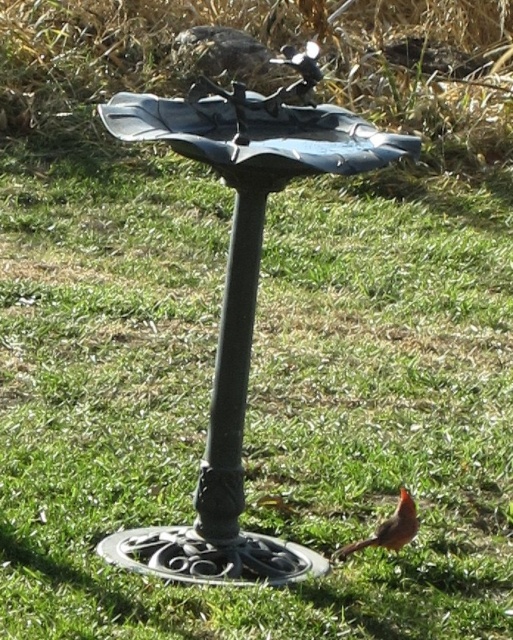
Question: Does black metal pole at center have a greater width compared to matte orange bird at lower right?

Choices:
 (A) no
 (B) yes

Answer: (A)

Question: Can you confirm if black metal pole at center is smaller than matte orange bird at lower right?

Choices:
 (A) yes
 (B) no

Answer: (B)

Question: Can you confirm if black metal pole at center is positioned below matte orange bird at lower right?

Choices:
 (A) yes
 (B) no

Answer: (B)

Question: Which object is closer to the camera taking this photo?

Choices:
 (A) matte orange bird at lower right
 (B) black metal pole at center

Answer: (B)

Question: Which of the following is the closest to the observer?

Choices:
 (A) matte orange bird at lower right
 (B) black metal pole at center

Answer: (B)